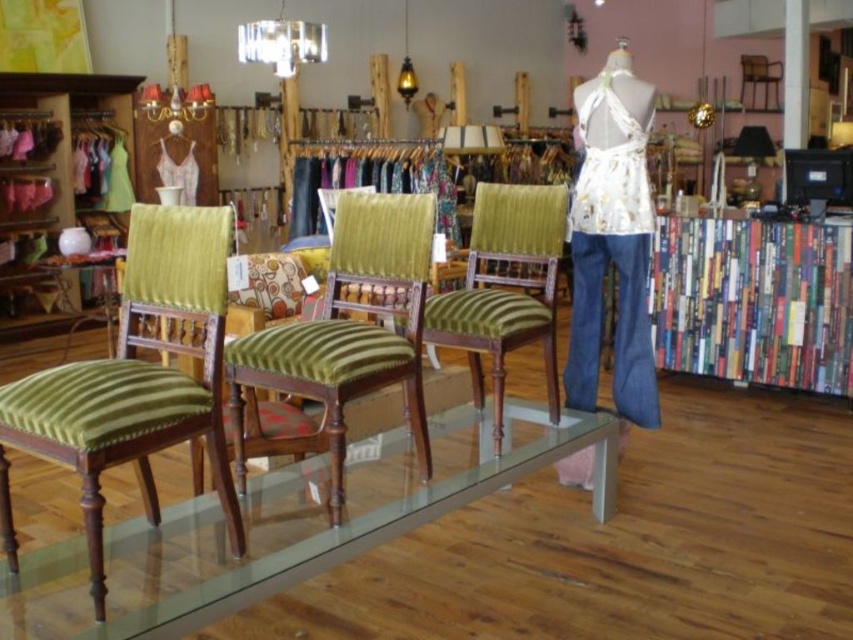
Who is shorter, green velvet chair at left or matte wood bookshelf at left?

green velvet chair at left is shorter.

Can you confirm if green velvet chair at left is positioned to the left of matte wood bookshelf at left?

No, green velvet chair at left is not to the left of matte wood bookshelf at left.

Measure the distance between point (x=39, y=436) and camera.

The distance of point (x=39, y=436) from camera is 5.85 feet.

Image resolution: width=853 pixels, height=640 pixels. In order to click on green velvet chair at left in this screenshot , I will do `click(135, 380)`.

Is multicolored wood bookshelf at right closer to the viewer compared to white floral fabric at center?

No, multicolored wood bookshelf at right is behind white floral fabric at center.

Can you confirm if multicolored wood bookshelf at right is bigger than white floral fabric at center?

Yes.

Is point (773, 272) in front of point (590, 136)?

No, it is behind (590, 136).

The image size is (853, 640). Find the location of `multicolored wood bookshelf at right`. multicolored wood bookshelf at right is located at coordinates (753, 301).

Is green velvet chair at center smaller than matte wood bookshelf at left?

Yes.

Between green velvet chair at center and matte wood bookshelf at left, which one is positioned lower?

green velvet chair at center is below.

Looking at this image, measure the distance between point (300, 433) and camera.

The distance of point (300, 433) from camera is 3.01 meters.

The image size is (853, 640). In order to click on green velvet chair at center in this screenshot , I will do `click(341, 339)`.